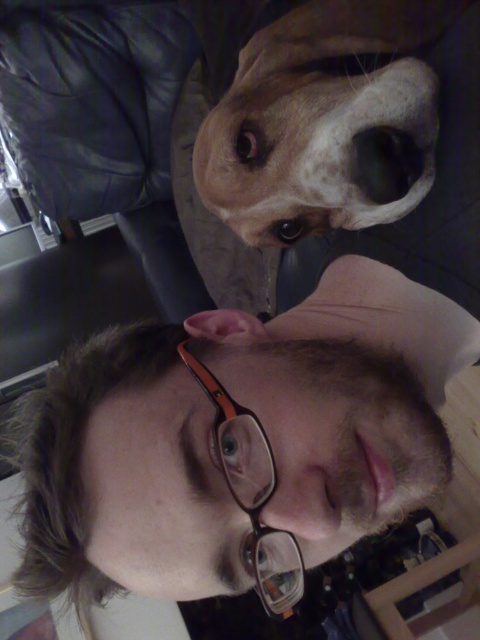
Question: Which point is closer to the camera?

Choices:
 (A) (423, 106)
 (B) (116, 560)

Answer: (B)

Question: Where is brown matte skin at upper center located in relation to brown fur dog at upper center in the image?

Choices:
 (A) left
 (B) right

Answer: (A)

Question: Is brown matte skin at upper center smaller than brown fur dog at upper center?

Choices:
 (A) yes
 (B) no

Answer: (B)

Question: Which point is farther from the camera taking this photo?

Choices:
 (A) (86, 371)
 (B) (260, 104)

Answer: (B)

Question: Can you confirm if brown matte skin at upper center is positioned below brown fur dog at upper center?

Choices:
 (A) no
 (B) yes

Answer: (B)